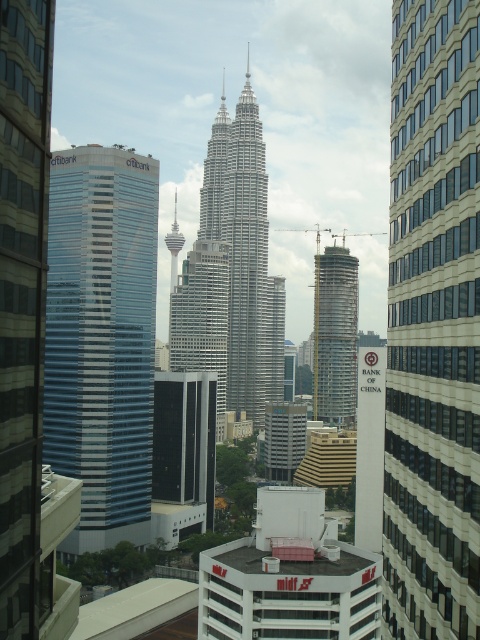
Question: Can you confirm if glassy silver skyscraper at center is bigger than sleek silver skyscraper at center?

Choices:
 (A) yes
 (B) no

Answer: (A)

Question: Which object is the closest to the sleek silver skyscraper at center?

Choices:
 (A) white glass building at center
 (B) blue glass skyscraper at left
 (C) black glass building at center
 (D) glassy silver skyscraper at center

Answer: (D)

Question: Is blue glass skyscraper at left positioned at the back of silver metallic twin towers at center?

Choices:
 (A) yes
 (B) no

Answer: (B)

Question: Among these points, which one is nearest to the camera?

Choices:
 (A) (337, 314)
 (B) (432, 92)

Answer: (B)

Question: Which of the following is the closest to the observer?

Choices:
 (A) (336, 362)
 (B) (140, 160)
 (C) (172, 458)
 (D) (176, 348)

Answer: (B)

Question: Does white glass building at center have a smaller size compared to blue glass skyscraper at left?

Choices:
 (A) no
 (B) yes

Answer: (B)